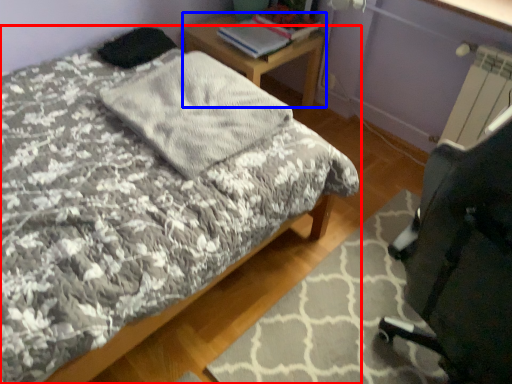
Question: Which of the following is the farthest to the observer, bed (highlighted by a red box) or desk (highlighted by a blue box)?

Choices:
 (A) bed
 (B) desk

Answer: (B)